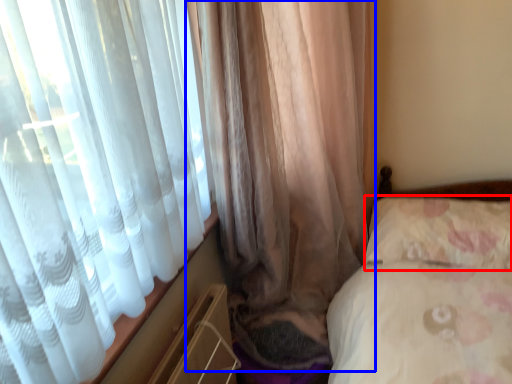
Question: Which object is closer to the camera taking this photo, pillow (highlighted by a red box) or curtain (highlighted by a blue box)?

Choices:
 (A) pillow
 (B) curtain

Answer: (B)